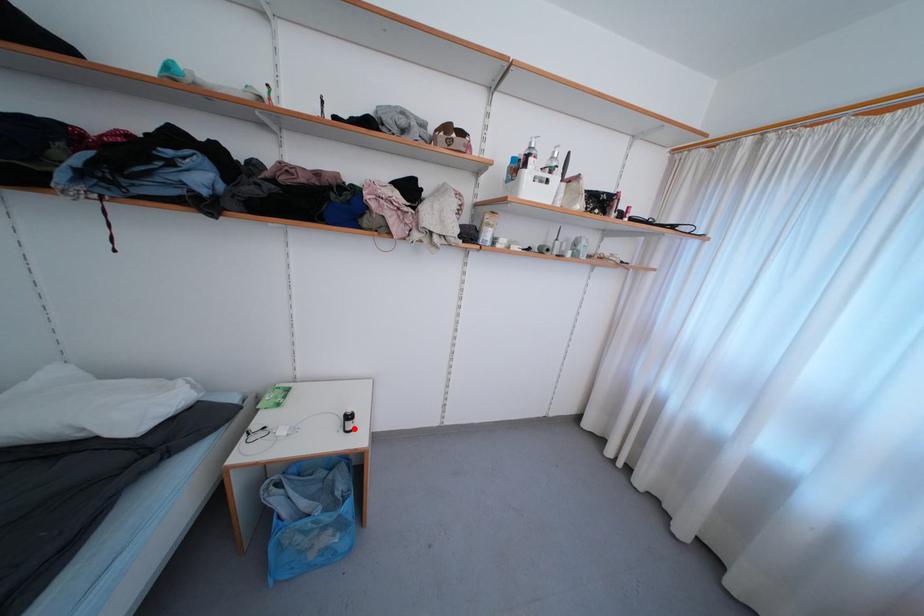
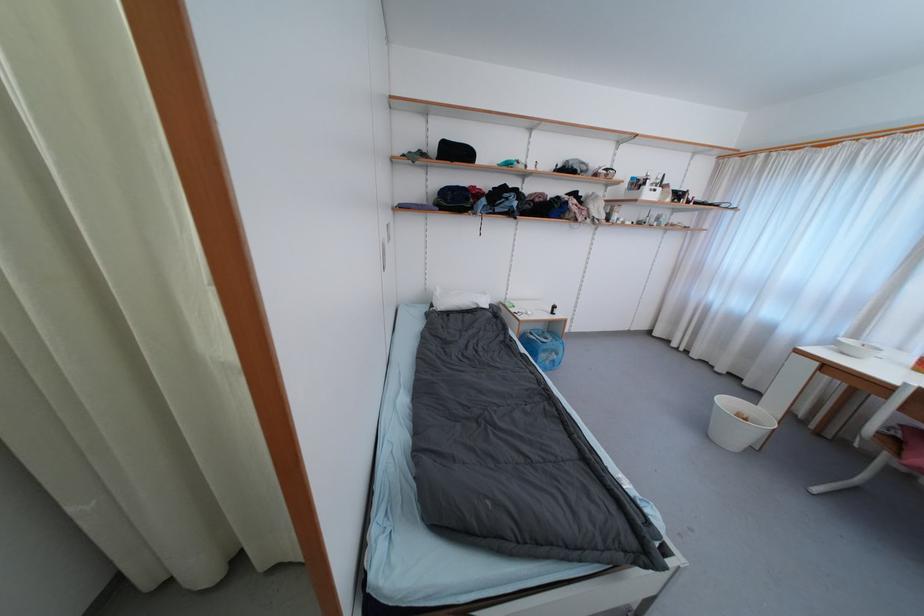
Locate, in the second image, the point that corresponds to the highlighted location in the first image.

(560, 313)